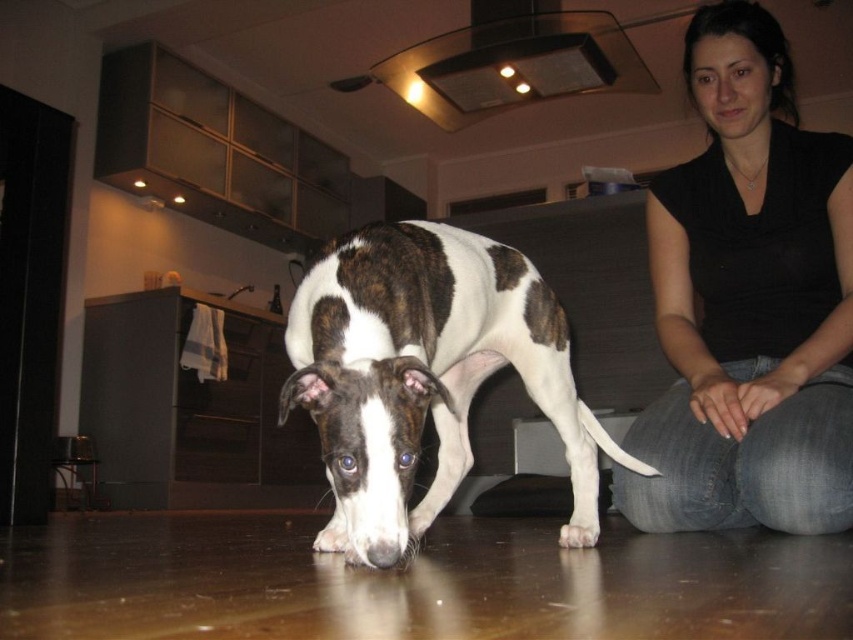
Is brown and white fur at center wider than white fur paw at lower center?

Indeed, brown and white fur at center has a greater width compared to white fur paw at lower center.

Does point (447, 262) come in front of point (582, 531)?

Yes.

You are a GUI agent. You are given a task and a screenshot of the screen. Output one action in this format:
    pyautogui.click(x=<x>, y=<y>)
    Task: Click on the brown and white fur at center
    
    Given the screenshot: What is the action you would take?
    click(422, 372)

Describe the element at coordinates (747, 301) in the screenshot. I see `black cotton shirt at upper right` at that location.

Is point (714, 136) less distant than point (581, 531)?

No, (714, 136) is behind (581, 531).

Identify the location of black cotton shirt at upper right. [747, 301].

Who is lower down, black cotton shirt at upper right or brown and white fur at center?

Positioned lower is brown and white fur at center.

Measure the distance between black cotton shirt at upper right and camera.

black cotton shirt at upper right and camera are 4.50 feet apart from each other.

Does point (795, 314) lie in front of point (381, 385)?

No, (795, 314) is behind (381, 385).

Find the location of a particular element. The height and width of the screenshot is (640, 853). black cotton shirt at upper right is located at coordinates (747, 301).